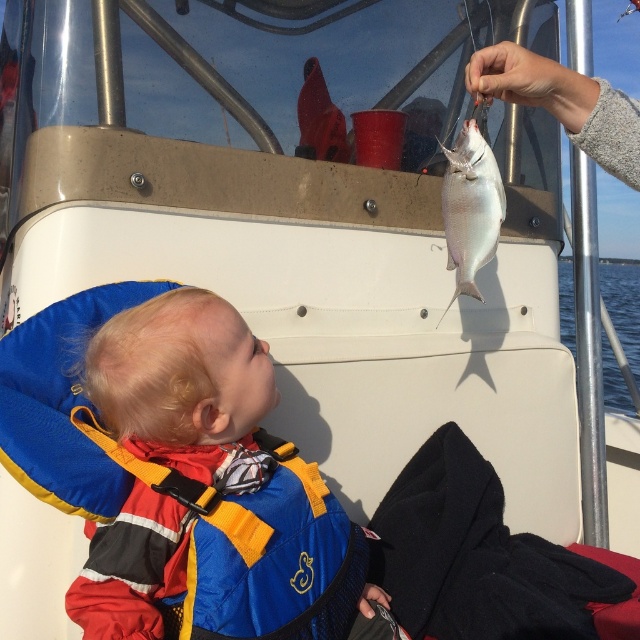
You are a passenger on the boat and want to hand a snack to the child wearing the blue fabric life vest at center. The snack is currently on the silver metallic fish at upper center. Which direction should you move to reach the child?

The blue fabric life vest at center is to the left of the silver metallic fish at upper center, so you should move to the left to reach the child.

You are on a boat and want to reach the point marked at coordinates (545, 108). If your arm can extend 5 feet, can you reach it?

The point at coordinates (545, 108) is 5.27 feet away from the camera, so your arm cannot reach it since it can only extend 5 feet.